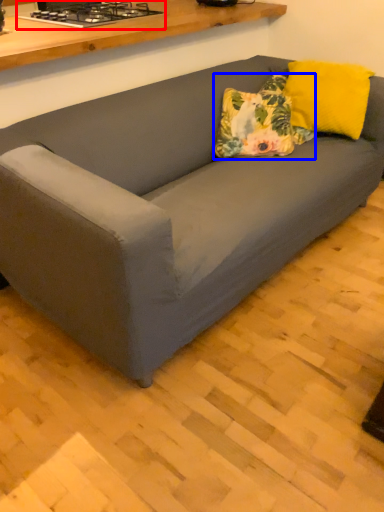
Question: Which of the following is the farthest to the observer, stove (highlighted by a red box) or throw pillow (highlighted by a blue box)?

Choices:
 (A) stove
 (B) throw pillow

Answer: (A)